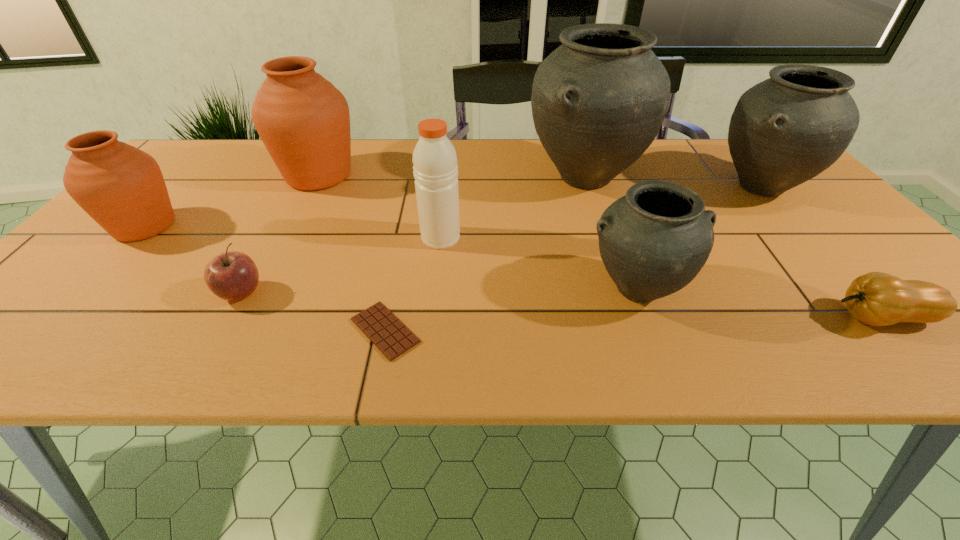
Find the location of `the nearest black urn`. the nearest black urn is located at coordinates (653, 241).

Where is `apple`? This screenshot has width=960, height=540. apple is located at coordinates coord(232,276).

In order to click on gourd in this screenshot , I will do `click(878, 299)`.

Identify the location of brown candy bar. (393, 338).

Locate an element on the screen. This screenshot has height=540, width=960. candy bar is located at coordinates [x=393, y=338].

In order to click on vacant space located 0.190m on the right of the biggest black urn in this screenshot , I will do `click(711, 178)`.

The image size is (960, 540). Identify the location of vacant space located on the back of the farther brown urn. (337, 140).

The height and width of the screenshot is (540, 960). Identify the location of free space located on the left of the rightmost urn. (634, 187).

Identify the location of vacant area situated 0.270m on the left of the shaker. (306, 238).

Locate an element on the screen. The height and width of the screenshot is (540, 960). vacant space located on the front of the left brown urn is located at coordinates (60, 318).